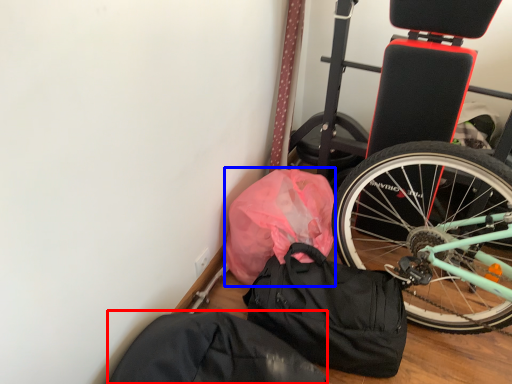
Question: Which object is closer to the camera taking this photo, sack (highlighted by a red box) or material (highlighted by a blue box)?

Choices:
 (A) sack
 (B) material

Answer: (A)